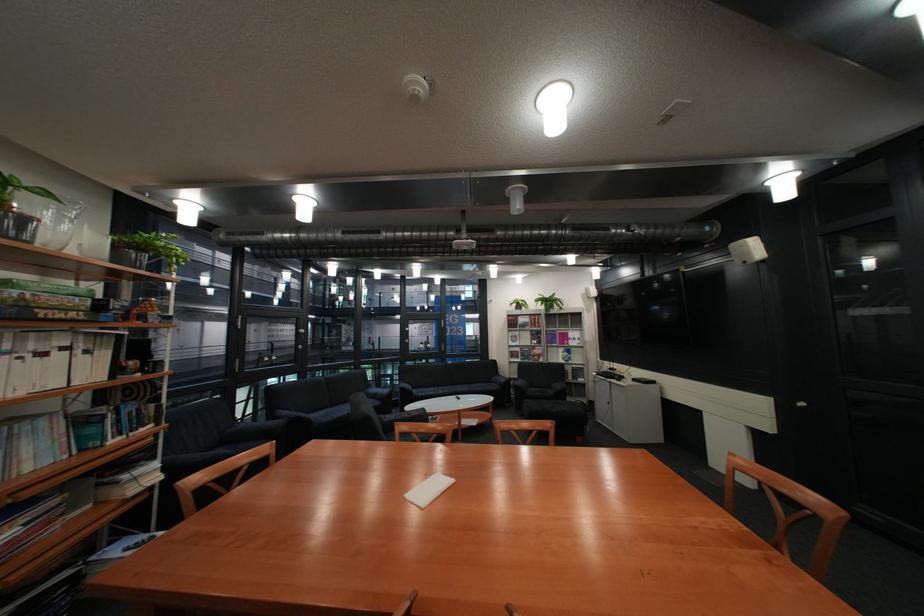
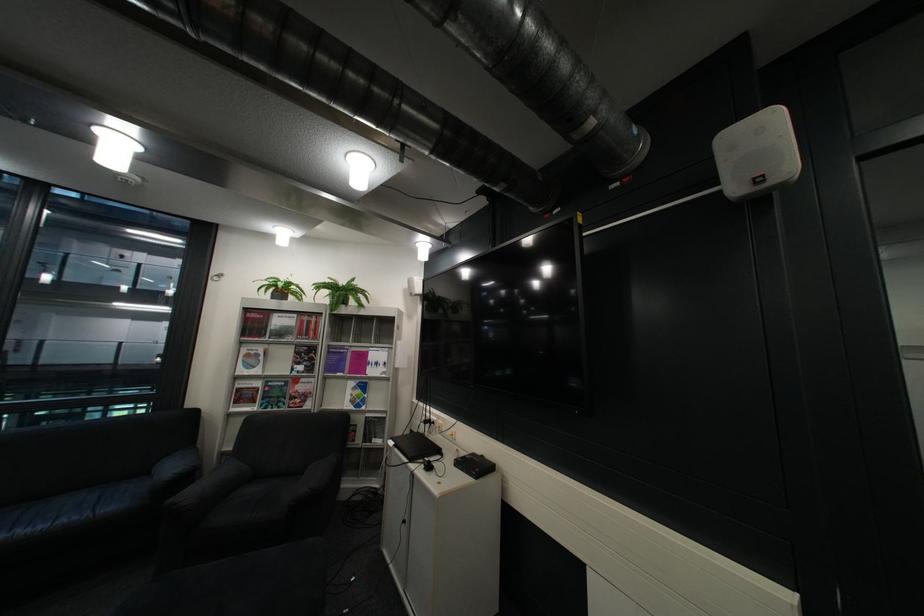
Locate, in the second image, the point that corresponds to point (530, 305) in the first image.

(287, 290)